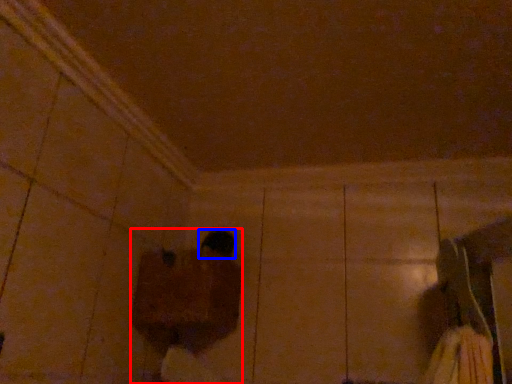
Question: Which object is further to the camera taking this photo, person (highlighted by a red box) or footwear (highlighted by a blue box)?

Choices:
 (A) person
 (B) footwear

Answer: (B)